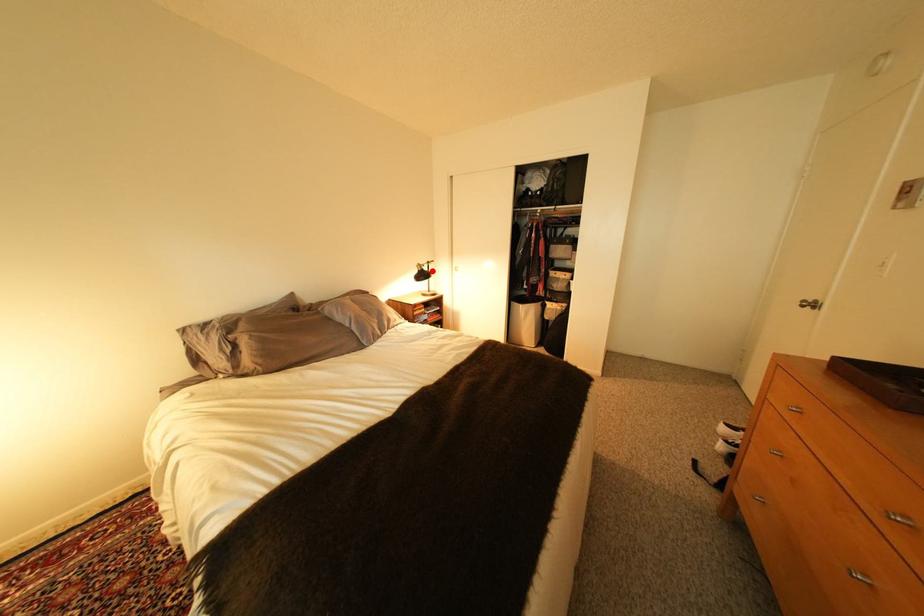
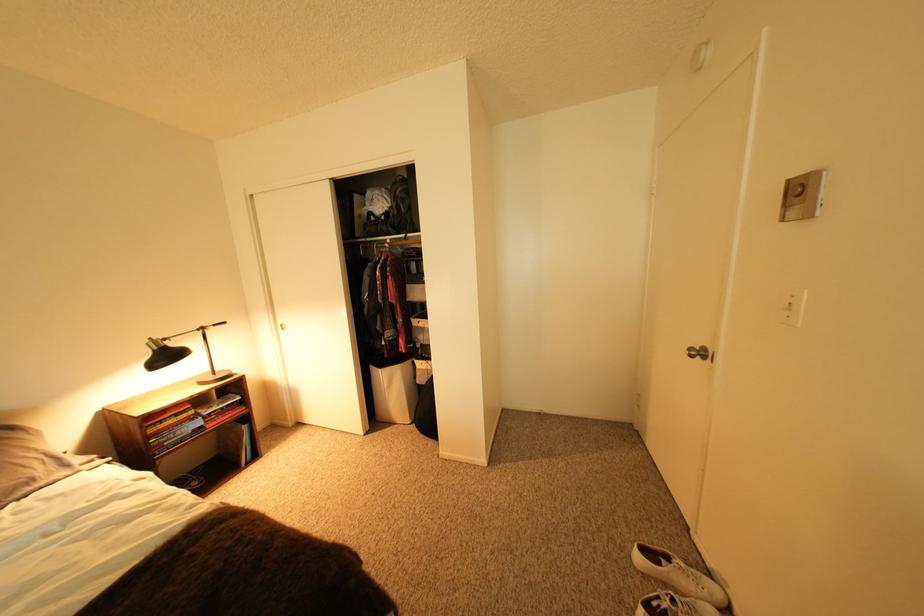
Question: I am providing you with two images of the same scene from different viewpoints. Image1 has a red point marked. In image2, the corresponding 3D location appears at what relative position? Reply with the corresponding letter.

Choices:
 (A) Closer
 (B) Farther

Answer: (B)